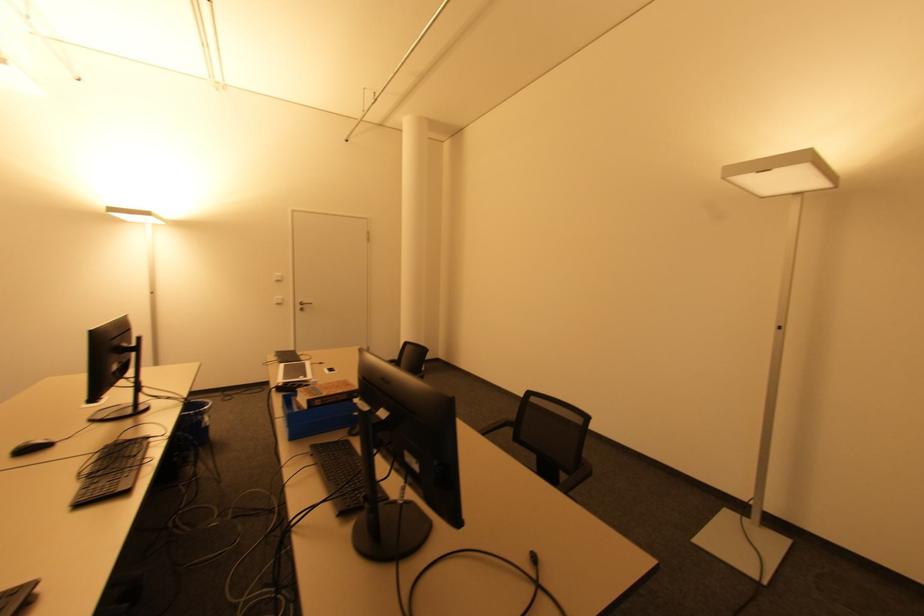
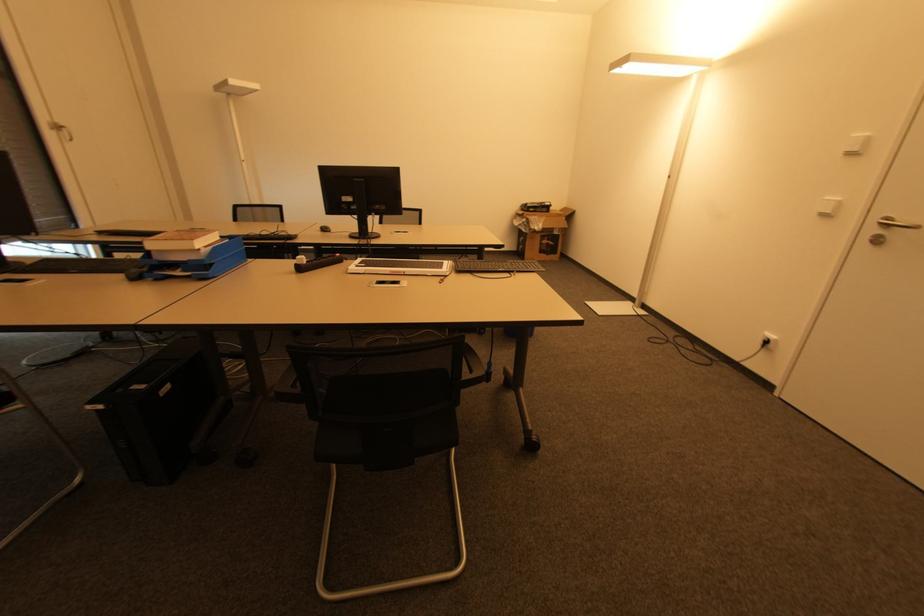
In the second image, find the point that corresponds to [283,302] in the first image.

(832, 214)